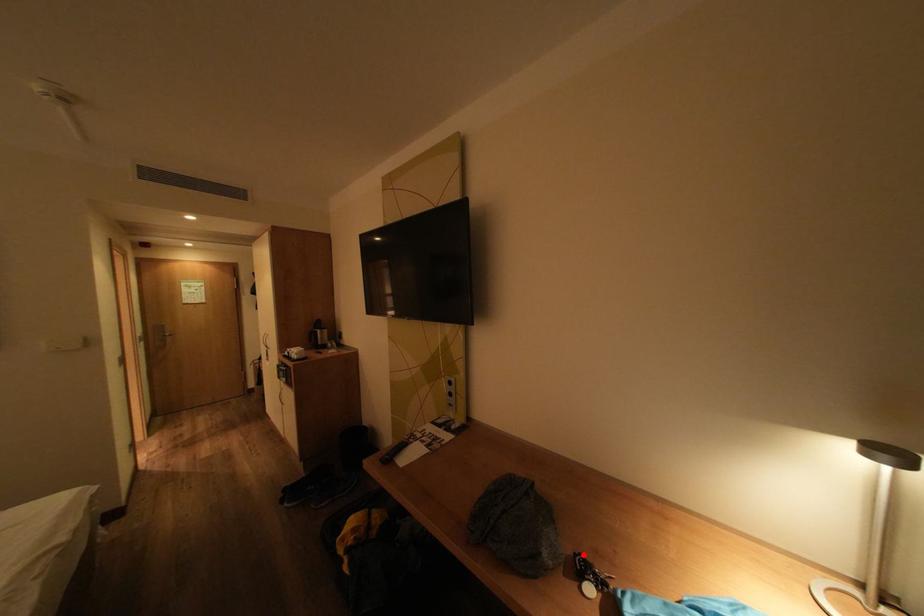
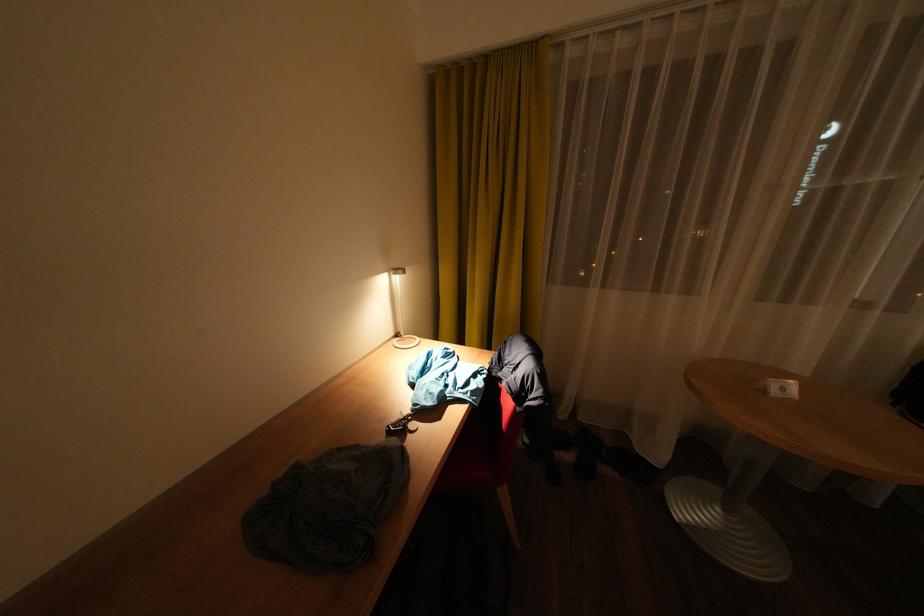
Where in the second image is the point corresponding to the highlighted location from the first image?

(395, 436)